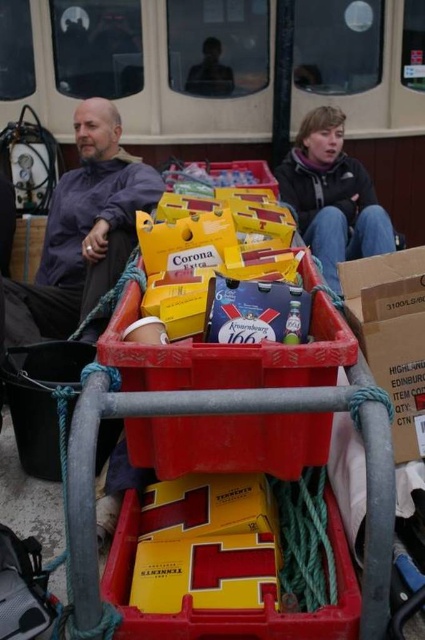
Can you confirm if matte purple shirt at left is positioned below dark gray fleece jacket at upper right?

Indeed, matte purple shirt at left is positioned under dark gray fleece jacket at upper right.

Does point (116, 118) lie in front of point (333, 264)?

No, it is not.

The image size is (425, 640). I want to click on matte purple shirt at left, so click(82, 230).

Can you confirm if matte purple shirt at left is positioned to the right of cardboard at center?

No, matte purple shirt at left is not to the right of cardboard at center.

Does matte purple shirt at left have a greater height compared to cardboard at center?

Correct, matte purple shirt at left is much taller as cardboard at center.

Which is behind, point (54, 221) or point (399, 346)?

The point (54, 221) is more distant.

Where is `matte purple shirt at left`? matte purple shirt at left is located at coordinates (82, 230).

Is cardboard at center thinner than dark gray fleece jacket at upper right?

Yes, cardboard at center is thinner than dark gray fleece jacket at upper right.

Find the location of a particular element. This screenshot has width=425, height=640. cardboard at center is located at coordinates (391, 336).

The image size is (425, 640). I want to click on cardboard at center, so click(x=391, y=336).